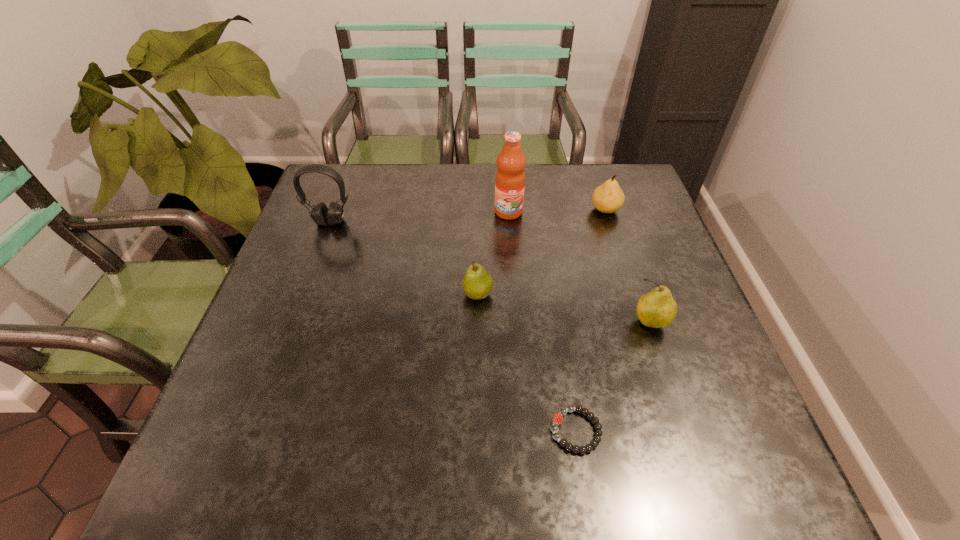
Locate an element on the screen. The width and height of the screenshot is (960, 540). vacant region that satisfies the following two spatial constraints: 1. on the front label of the bracelet; 2. on the right side of the tallest object is located at coordinates (524, 430).

In order to click on vacant space that satisfies the following two spatial constraints: 1. on the back side of the fifth object from right to left; 2. on the right side of the farthest pear in this screenshot , I will do `click(478, 210)`.

The width and height of the screenshot is (960, 540). What are the coordinates of `vacant space that satisfies the following two spatial constraints: 1. on the front-facing side of the second farthest pear; 2. on the left side of the leftmost object` in the screenshot? It's located at (303, 294).